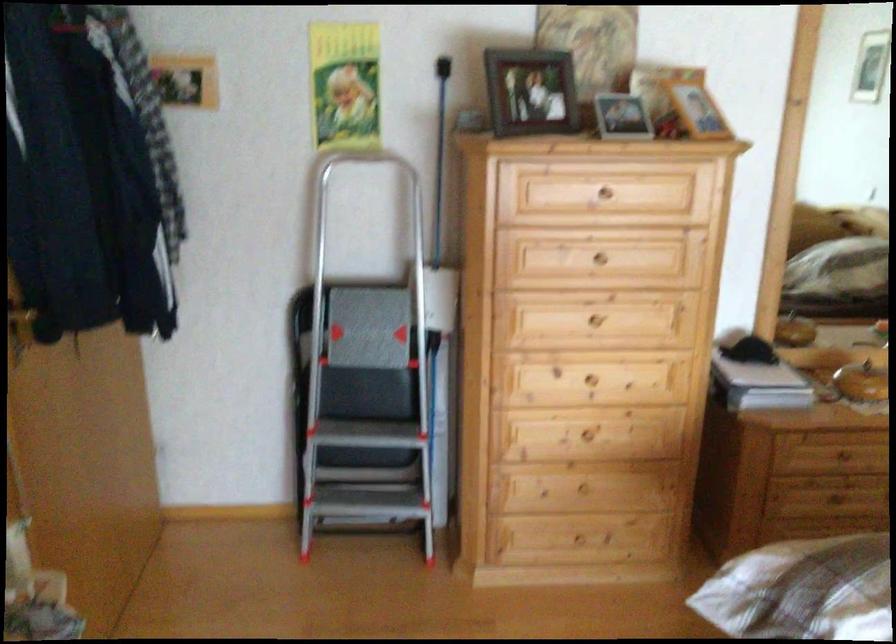
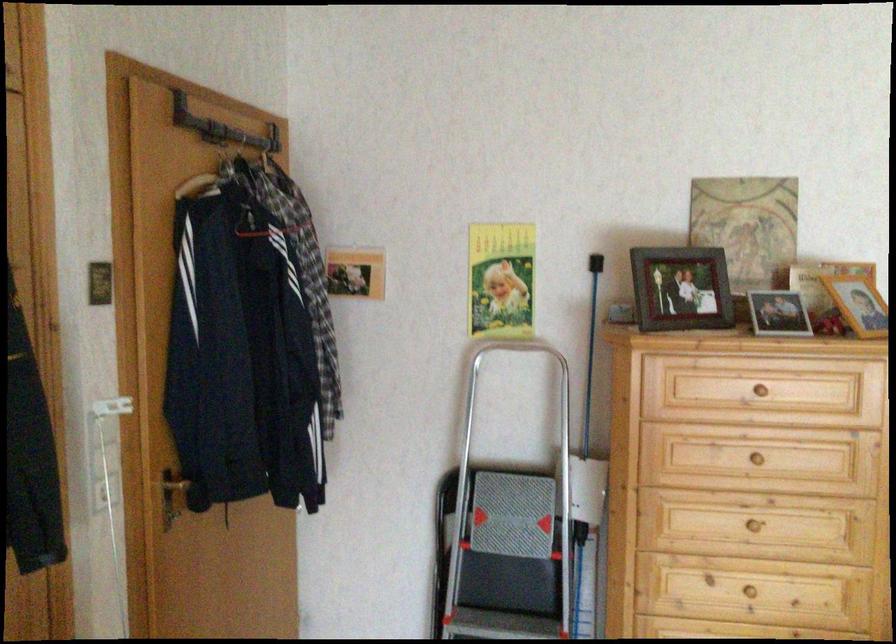
The point at (604, 194) is marked in the first image. Where is the corresponding point in the second image?

(763, 391)